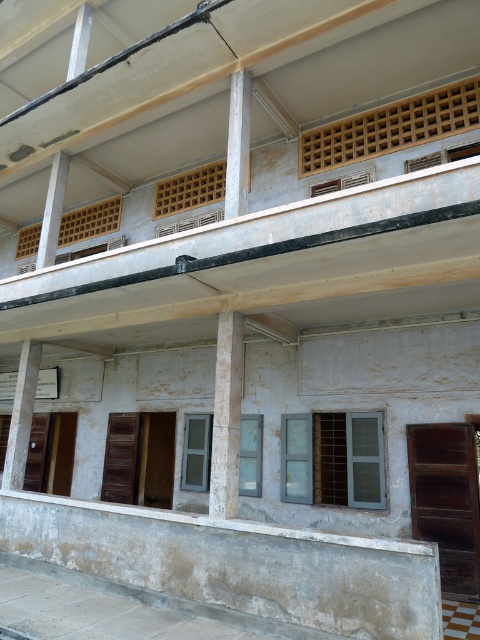
Question: Which point is farther to the camera?

Choices:
 (A) (61, 168)
 (B) (28, 339)
 (C) (238, 312)
 (D) (432, 134)

Answer: (A)

Question: Is wooden lattice at upper center closer to the viewer compared to white painted wood at center?

Choices:
 (A) yes
 (B) no

Answer: (A)

Question: In this image, where is white concrete column at center located relative to white concrete pillar at center?

Choices:
 (A) above
 (B) below

Answer: (B)

Question: Which object appears farthest from the camera in this image?

Choices:
 (A) white concrete column at center
 (B) wooden lattice at upper center
 (C) white concrete pillar at lower left
 (D) white painted wood at center

Answer: (D)

Question: Does white concrete column at center come in front of white concrete pillar at center?

Choices:
 (A) no
 (B) yes

Answer: (B)

Question: Estimate the real-world distances between objects in this image. Which object is farther from the wooden lattice at upper center?

Choices:
 (A) white concrete column at center
 (B) white painted wood at center

Answer: (B)